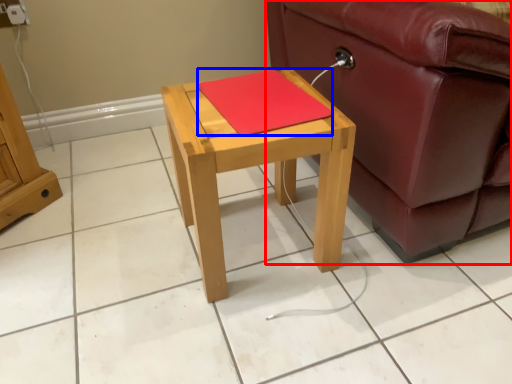
Question: Among these objects, which one is farthest to the camera, studio couch (highlighted by a red box) or pad (highlighted by a blue box)?

Choices:
 (A) studio couch
 (B) pad

Answer: (B)